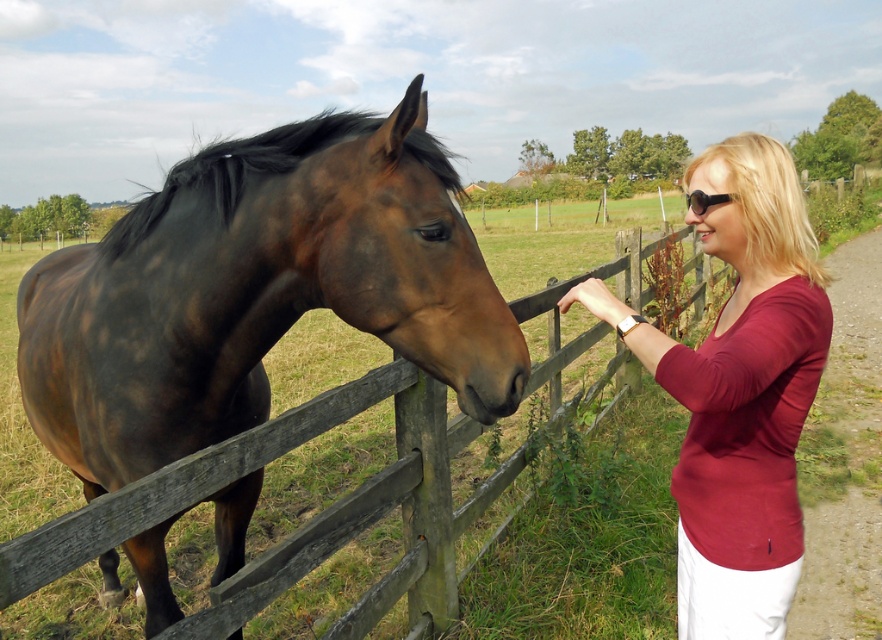
Question: Is brown glossy horse at left closer to the viewer compared to burgundy fabric shirt at right?

Choices:
 (A) yes
 (B) no

Answer: (A)

Question: Can you confirm if brown glossy horse at left is positioned above burgundy fabric shirt at right?

Choices:
 (A) no
 (B) yes

Answer: (A)

Question: Is brown glossy horse at left behind burgundy fabric shirt at right?

Choices:
 (A) no
 (B) yes

Answer: (A)